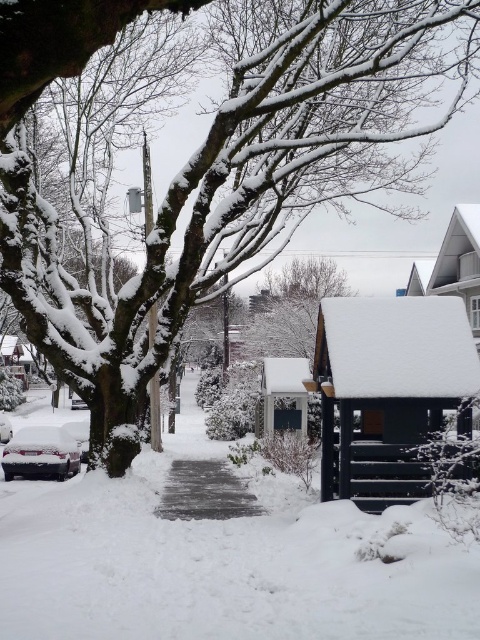
Looking at this image, who is positioned more to the right, white fluffy snow at center or sleek silver sedan at lower left?

white fluffy snow at center

Does white fluffy snow at center have a lesser height compared to sleek silver sedan at lower left?

No, white fluffy snow at center is not shorter than sleek silver sedan at lower left.

Which is behind, point (310, 532) or point (6, 448)?

Positioned behind is point (6, 448).

Find the location of `white fluffy snow at center`. white fluffy snow at center is located at coordinates (x=222, y=563).

Can you confirm if gray concrete pavement at center is positioned to the left of sleek silver sedan at lower left?

In fact, gray concrete pavement at center is to the right of sleek silver sedan at lower left.

Based on the photo, can you confirm if gray concrete pavement at center is wider than sleek silver sedan at lower left?

→ Yes, gray concrete pavement at center is wider than sleek silver sedan at lower left.

Is point (175, 461) more distant than point (70, 458)?

That is True.

The image size is (480, 640). I want to click on gray concrete pavement at center, so click(x=204, y=492).

This screenshot has width=480, height=640. Describe the element at coordinates (204, 492) in the screenshot. I see `gray concrete pavement at center` at that location.

Which of these two, gray concrete pavement at center or snow-covered sedan at lower left, stands shorter?

Standing shorter between the two is gray concrete pavement at center.

Does point (248, 508) come closer to viewer compared to point (7, 440)?

Yes, point (248, 508) is closer to viewer.

In order to click on gray concrete pavement at center in this screenshot , I will do `click(204, 492)`.